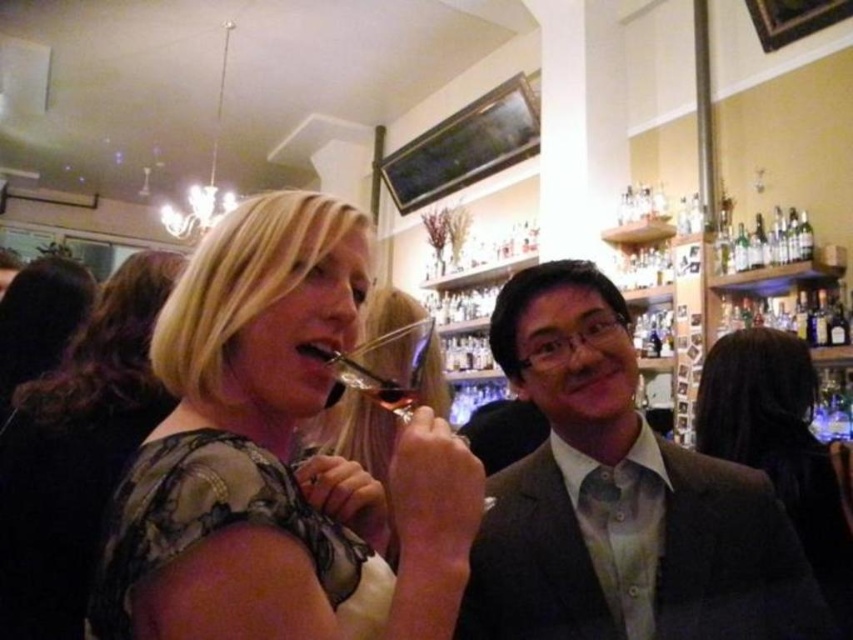
Who is lower down, matte floral dress at center or transparent glass wine glass at center?

matte floral dress at center is lower down.

Which of these two, matte floral dress at center or transparent glass wine glass at center, stands shorter?

transparent glass wine glass at center

In order to click on matte floral dress at center in this screenshot , I will do `click(274, 456)`.

Which is more to the right, camouflage-patterned dress at center or transparent glass wine glass at center?

transparent glass wine glass at center

Looking at this image, does camouflage-patterned dress at center appear under transparent glass wine glass at center?

Yes.

Find the location of a particular element. Image resolution: width=853 pixels, height=640 pixels. camouflage-patterned dress at center is located at coordinates (77, 451).

Which of these two, matte black dress at center or camouflage-patterned dress at center, stands shorter?

matte black dress at center is shorter.

Is point (198, 502) positioned behind point (149, 301)?

No, (198, 502) is closer to viewer.

Where is `matte black dress at center`? The height and width of the screenshot is (640, 853). matte black dress at center is located at coordinates (273, 456).